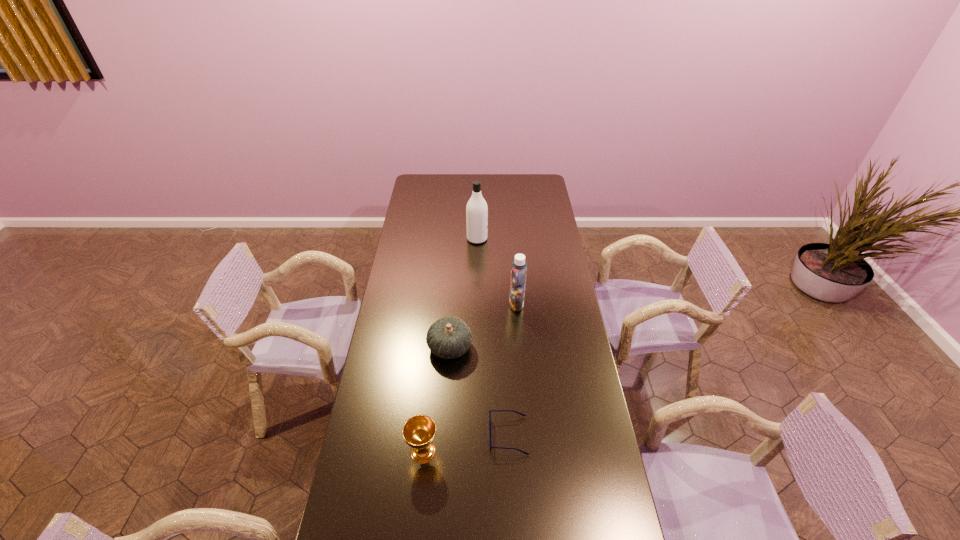
The image size is (960, 540). What are the coordinates of `the farther shampoo` in the screenshot? It's located at (476, 210).

Find the location of `the left shampoo`. the left shampoo is located at coordinates (476, 210).

This screenshot has height=540, width=960. In order to click on the right shampoo in this screenshot , I will do `click(518, 267)`.

Locate an element on the screen. The width and height of the screenshot is (960, 540). the shorter shampoo is located at coordinates (518, 267).

Identify the location of gourd. (449, 337).

Where is `chalice`? chalice is located at coordinates (419, 431).

Where is `spectacles`? spectacles is located at coordinates (490, 411).

Image resolution: width=960 pixels, height=540 pixels. Find the location of `free space located 0.140m on the front-facing side of the taller shampoo`. free space located 0.140m on the front-facing side of the taller shampoo is located at coordinates (515, 239).

Locate an element on the screen. Image resolution: width=960 pixels, height=540 pixels. vacant space located 0.240m on the front label of the fourth shortest object is located at coordinates (454, 304).

I want to click on free space located on the front label of the fourth shortest object, so click(443, 304).